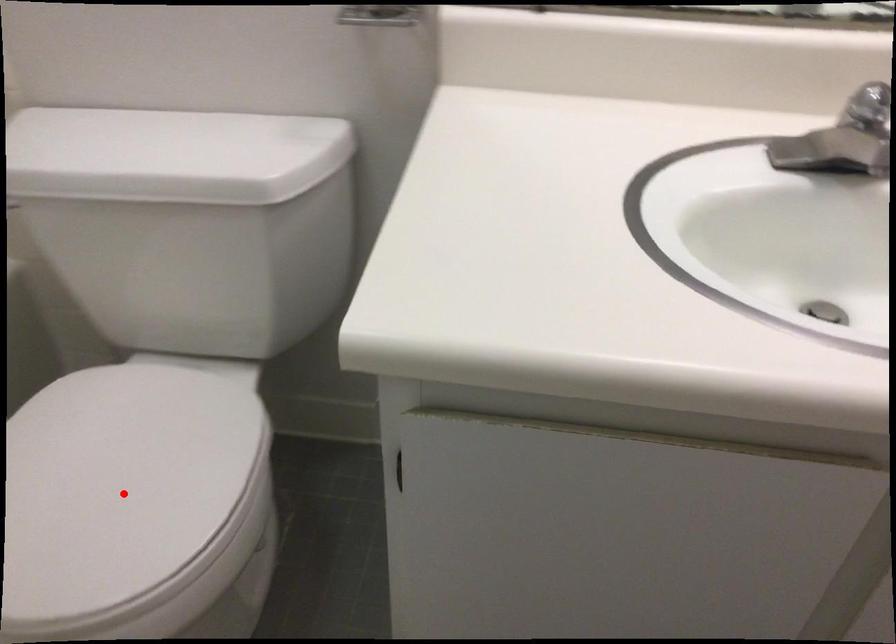
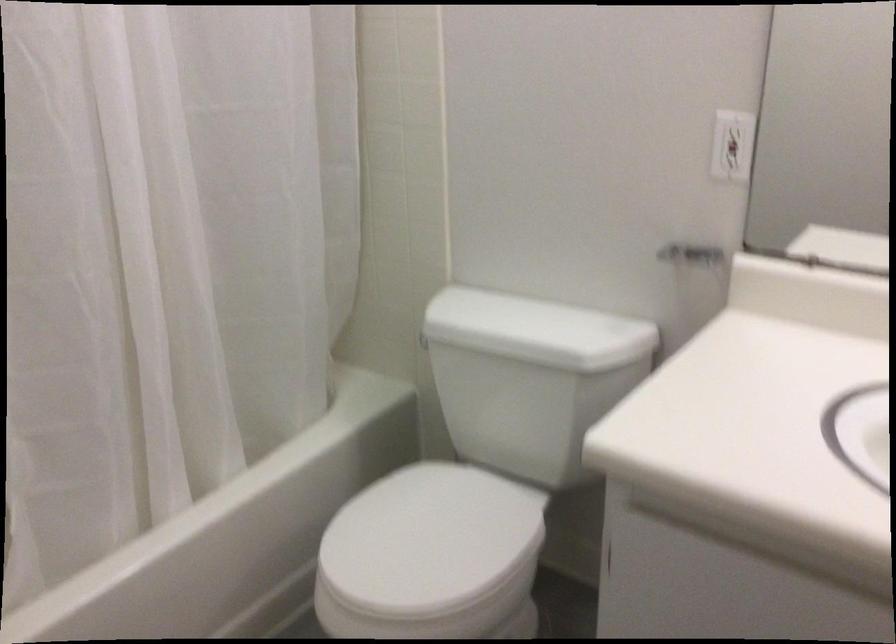
Question: I am providing you with two images of the same scene from different viewpoints. In image1, a red point is highlighted. Considering the same 3D point in image2, which of the following is correct?

Choices:
 (A) It is closer
 (B) It is farther

Answer: (B)